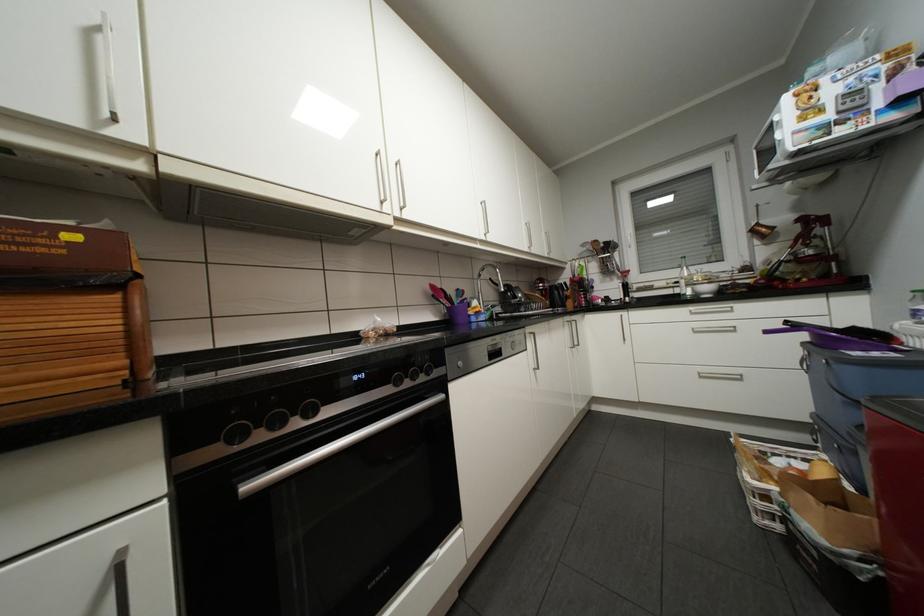
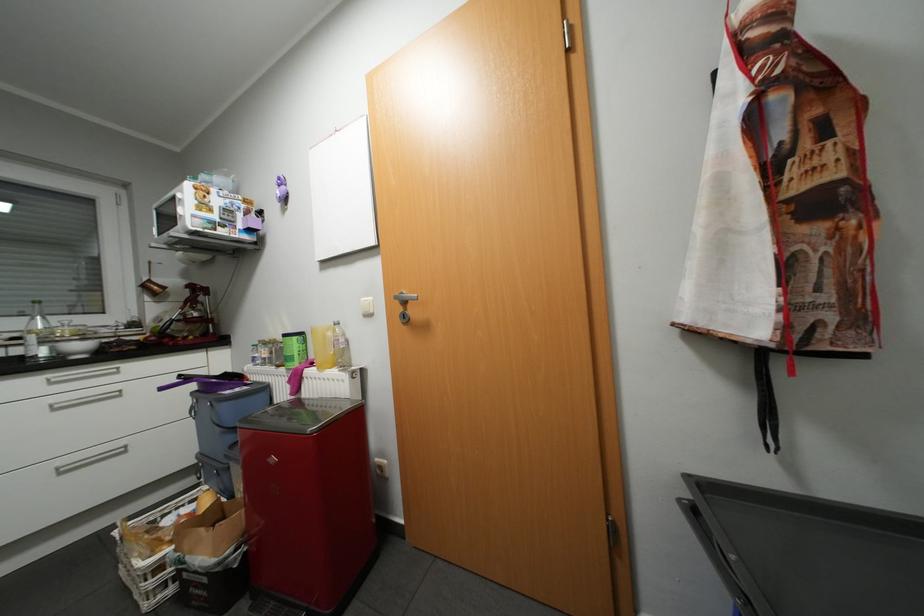
The point at (699, 313) is marked in the first image. Where is the corresponding point in the second image?

(61, 382)